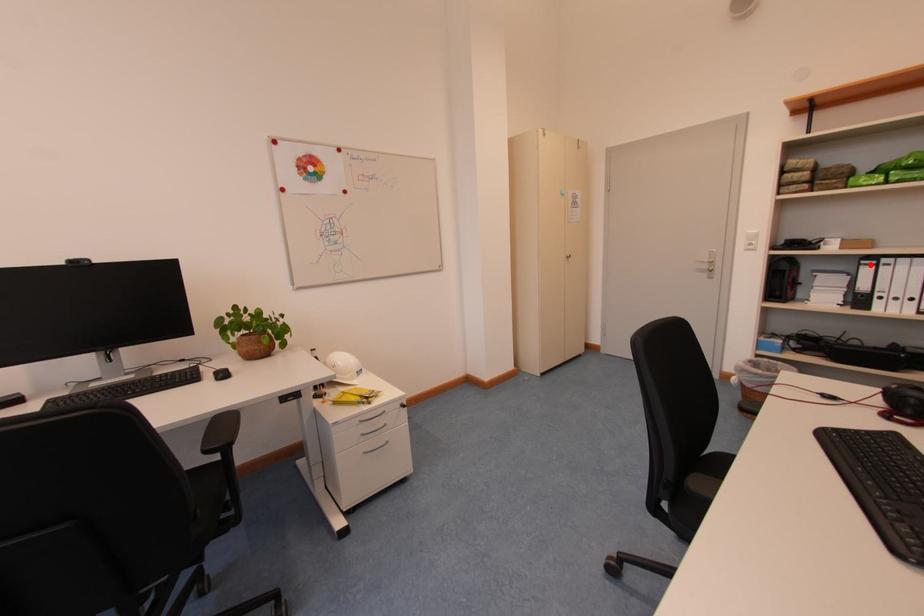
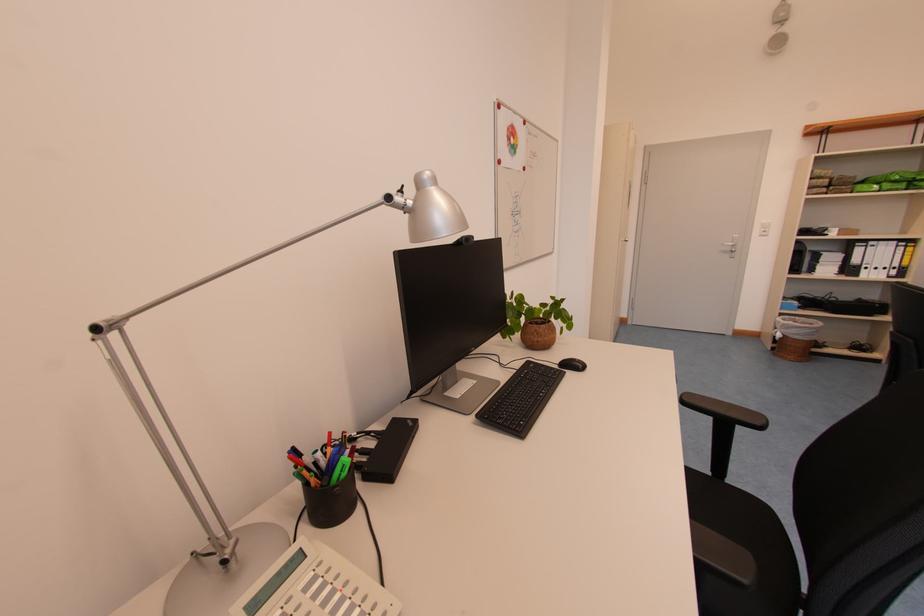
The point at the highlighted location is marked in the first image. Where is the corresponding point in the second image?

(865, 246)